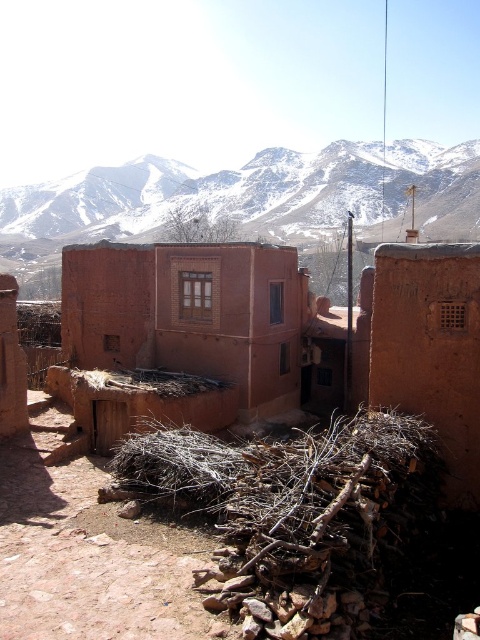
You are an architect designing a new structure in this village. You have two materials available from the scene, the brown dry wood at lower center and the snowy rock at upper center. If you want to use the larger material for the foundation, which one should you choose?

Answer: The snowy rock at upper center is larger than the brown dry wood at lower center, so you should choose the snowy rock at upper center for the foundation.

You are a traveler standing at the entrance of the village and want to find the brown dry wood at lower center. According to the coordinates given, where should you look relative to the center of the image?

The brown dry wood at lower center is located at coordinates point (292, 504), which means it is positioned to the right and slightly above the center of the image.